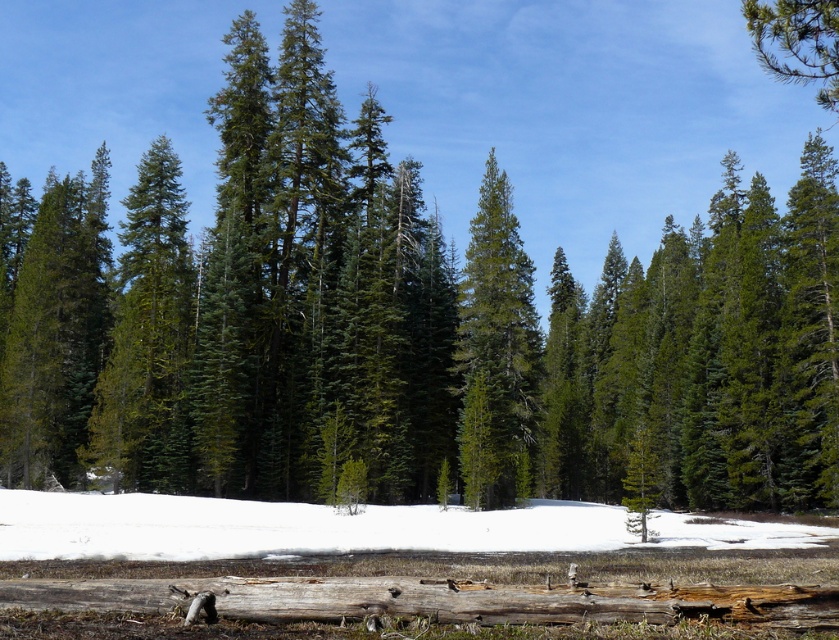
From the picture: You are standing in the forest scene described. There is a point marked at coordinates (345, 529). What can you find at that exact point?

At point (345, 529) lies white fluffy snow at lower center.

You are a hiker who wants to take a photo of the white fluffy snow at lower center. Where should you position yourself to capture it in the frame?

The white fluffy snow at lower center is located at the coordinates 0.827 on the x axis and 0.412 on the y axis, so you should position yourself facing the lower center area of the scene to capture it in the frame.